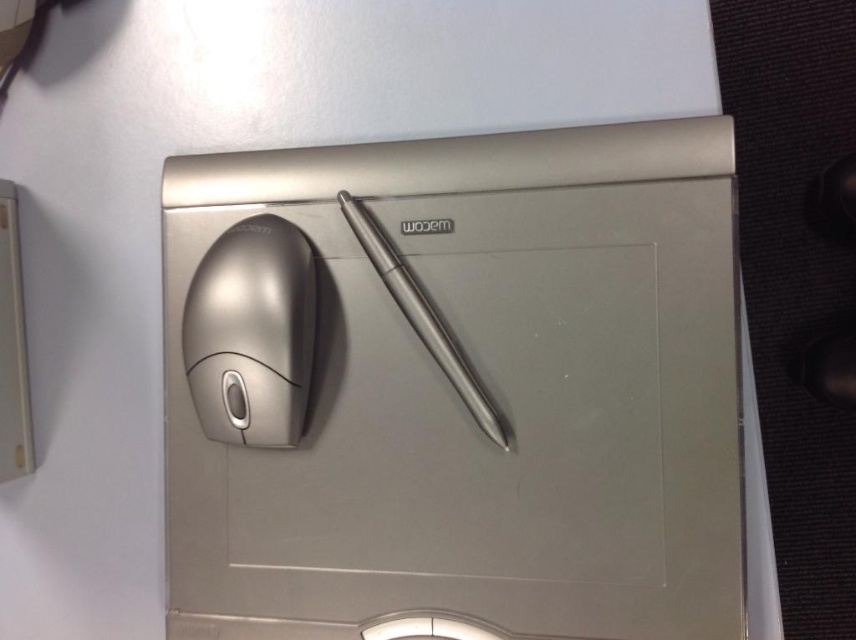
Question: Can you confirm if satin silver mouse at left is positioned below satin silver pen at center?

Choices:
 (A) no
 (B) yes

Answer: (B)

Question: Is satin silver mouse at left thinner than satin silver pen at center?

Choices:
 (A) no
 (B) yes

Answer: (B)

Question: Which object is closer to the camera taking this photo?

Choices:
 (A) satin silver mouse at left
 (B) satin silver pen at center
 (C) satin silver mouse at center

Answer: (C)

Question: Which point appears farthest from the camera in this image?

Choices:
 (A) (489, 138)
 (B) (187, 312)
 (C) (467, 385)

Answer: (B)

Question: Can you confirm if satin silver mouse at center is smaller than satin silver pen at center?

Choices:
 (A) no
 (B) yes

Answer: (A)

Question: Which object appears closest to the camera in this image?

Choices:
 (A) satin silver mouse at left
 (B) satin silver mouse at center
 (C) satin silver pen at center

Answer: (B)